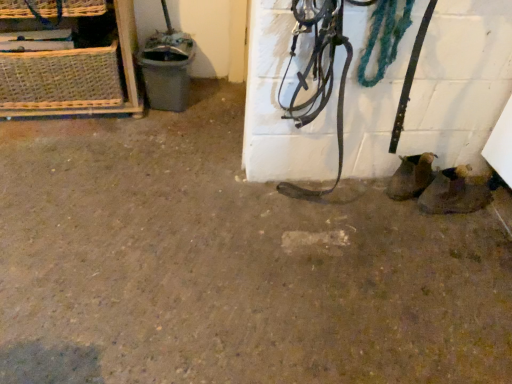
Question: Are brown leather boots at lower right and woven straw basket at upper left far apart?

Choices:
 (A) no
 (B) yes

Answer: (B)

Question: Can you confirm if brown leather boots at lower right is shorter than woven straw basket at upper left?

Choices:
 (A) no
 (B) yes

Answer: (B)

Question: Is brown leather boots at lower right beside woven straw basket at upper left?

Choices:
 (A) no
 (B) yes

Answer: (A)

Question: Is brown leather boots at lower right aimed at woven straw basket at upper left?

Choices:
 (A) no
 (B) yes

Answer: (A)

Question: From the image's perspective, does brown leather boots at lower right appear lower than woven straw basket at upper left?

Choices:
 (A) yes
 (B) no

Answer: (A)

Question: From a real-world perspective, is brown leather boots at lower right physically above woven straw basket at upper left?

Choices:
 (A) yes
 (B) no

Answer: (B)

Question: From the image's perspective, would you say woven straw basket at upper left is shown under brown leather boots at lower right?

Choices:
 (A) yes
 (B) no

Answer: (B)

Question: Is woven straw basket at upper left located outside brown leather boots at lower right?

Choices:
 (A) yes
 (B) no

Answer: (A)

Question: Does woven straw basket at upper left have a lesser width compared to brown leather boots at lower right?

Choices:
 (A) no
 (B) yes

Answer: (A)

Question: Is woven straw basket at upper left far away from brown leather boots at lower right?

Choices:
 (A) no
 (B) yes

Answer: (B)

Question: From a real-world perspective, is woven straw basket at upper left physically above brown leather boots at lower right?

Choices:
 (A) no
 (B) yes

Answer: (B)

Question: Is woven straw basket at upper left beside brown leather boots at lower right?

Choices:
 (A) yes
 (B) no

Answer: (B)

Question: Is woven straw basket at upper left inside or outside of brown leather boots at lower right?

Choices:
 (A) outside
 (B) inside

Answer: (A)